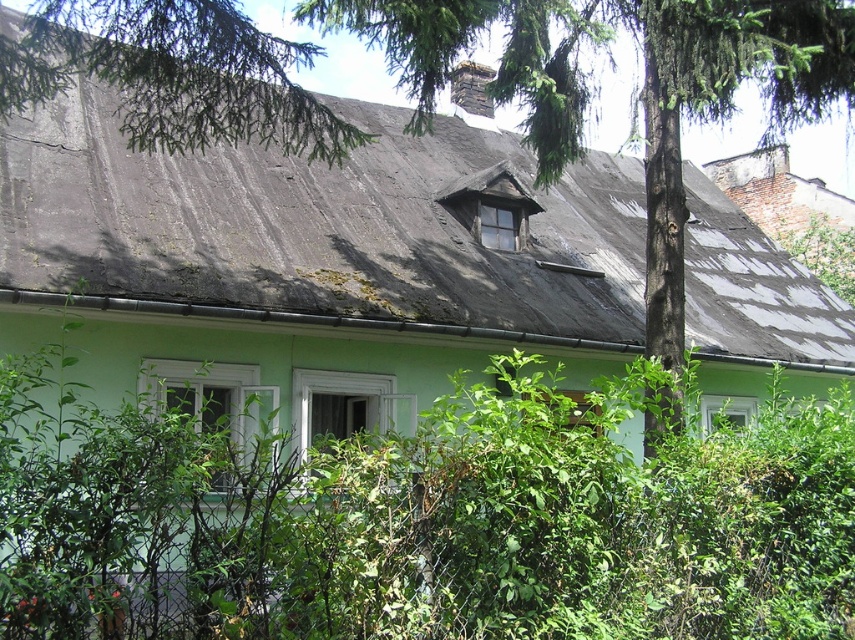
Is green leafy bush at center below gray shingles at upper center?

Yes, green leafy bush at center is below gray shingles at upper center.

Is green leafy bush at center shorter than gray shingles at upper center?

Yes.

Is point (89, 541) farther from camera compared to point (77, 115)?

No, (89, 541) is in front of (77, 115).

The width and height of the screenshot is (855, 640). What are the coordinates of `green leafy bush at center` in the screenshot? It's located at (426, 518).